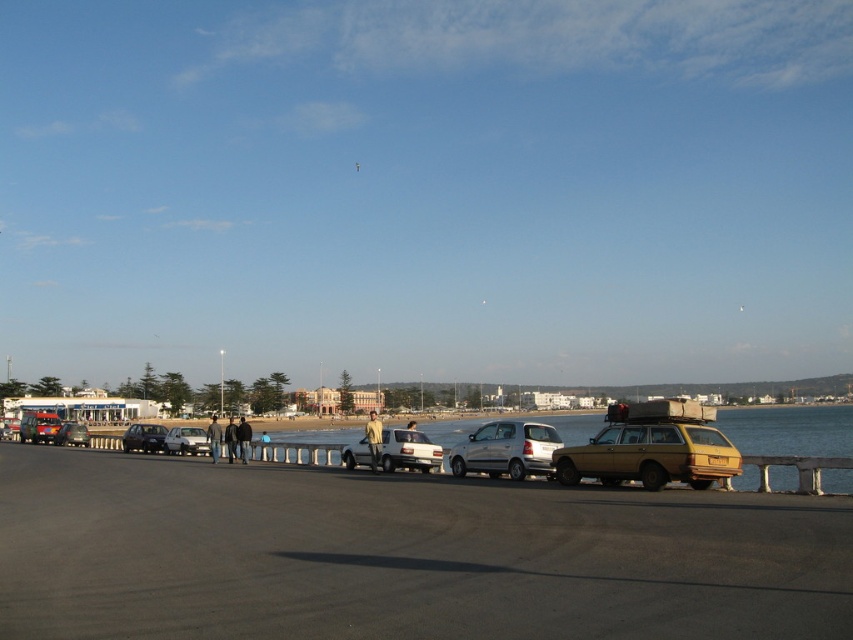
You are a photographer setting up a tripod to capture the coastal scene. You need to position it so that both the matte silver suv at center and the shiny silver sedan at center are fully visible in the frame. Given their heights, which vehicle might require adjusting your camera angle to avoid being blocked by the other?

The matte silver suv at center is taller than the shiny silver sedan at center. To ensure both are fully visible, you may need to lower your camera angle slightly to avoid the suv blocking the sedan below it.

You are standing on the road in the coastal scene and want to walk towards the beach. There are two points marked on the image at coordinates point (21, 436) and point (123, 436). Which point should you head towards to reach the beach faster?

Point (123, 436) is closer to the beach because it is further from the viewer compared to point (21, 436), which is nearer to you. Since you want to reach the beach faster, you should head towards point (123, 436) as it is already closer to the beach area.